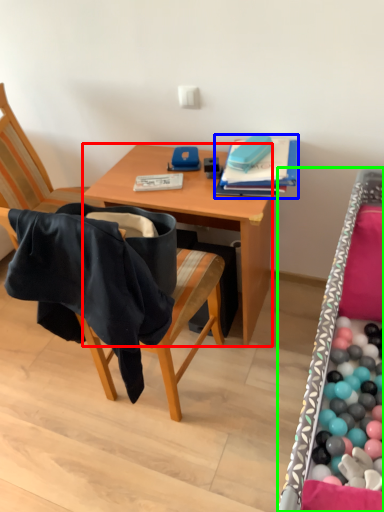
Question: Which object is positioned farthest from desk (highlighted by a red box)? Select from book (highlighted by a blue box) and bed frame (highlighted by a green box).

Choices:
 (A) book
 (B) bed frame

Answer: (B)